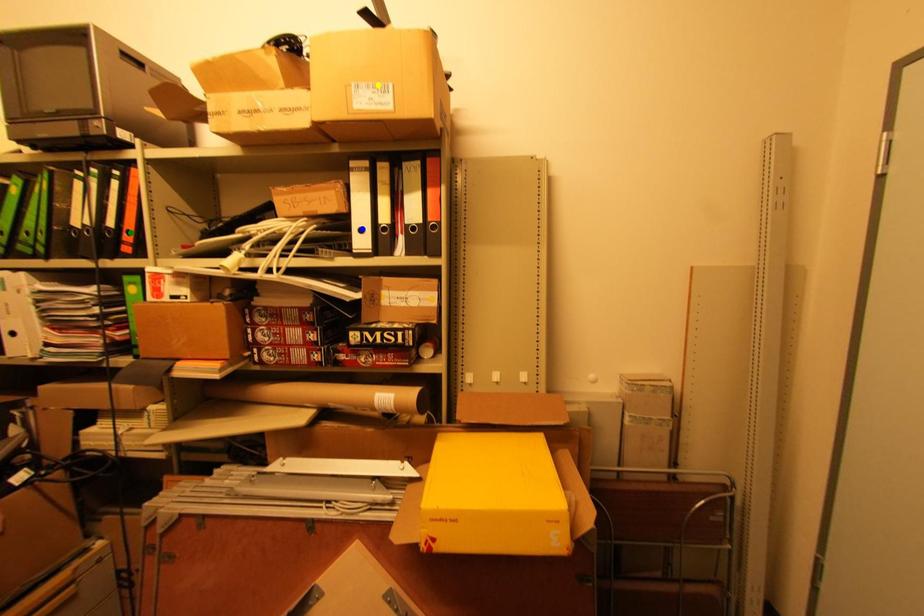
Order these from nearest to farthest:
A) yellow point
B) blue point
C) green point

yellow point, blue point, green point